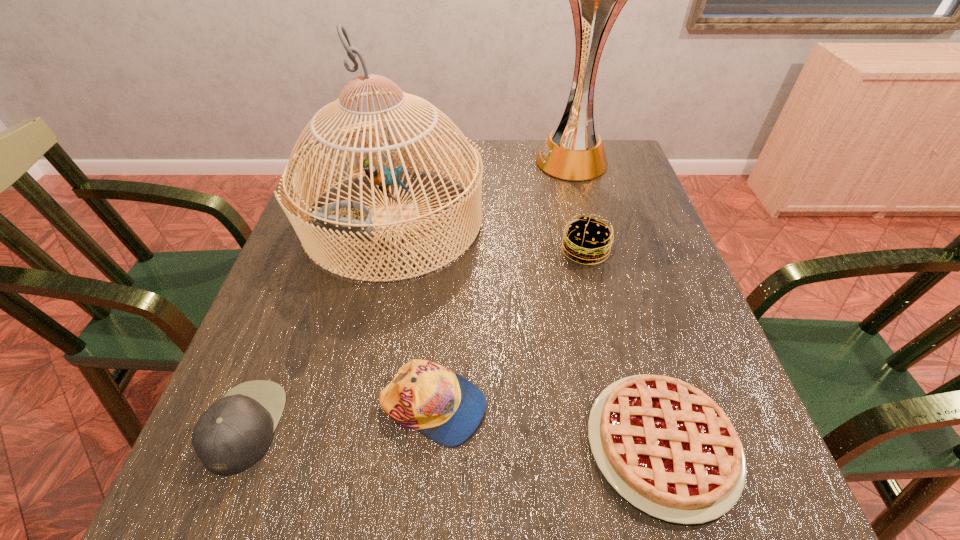
I want to click on free space between the tallest object and the third tallest object, so click(x=579, y=206).

Locate an element on the screen. free area in between the fifth shortest object and the tallest object is located at coordinates (483, 191).

Where is `the fifth closest object to the tallest object`? The image size is (960, 540). the fifth closest object to the tallest object is located at coordinates (230, 436).

You are a GUI agent. You are given a task and a screenshot of the screen. Output one action in this format:
    pyautogui.click(x=<x>, y=<y>)
    Task: Click on the object that is the third closest one to the left cap
    
    Given the screenshot: What is the action you would take?
    pyautogui.click(x=666, y=447)

This screenshot has height=540, width=960. In order to click on vacant space that satisfies the following two spatial constraints: 1. on the brim of the shortest object; 2. on the left side of the left cap in this screenshot , I will do `click(237, 444)`.

The height and width of the screenshot is (540, 960). What are the coordinates of `vacant space that satisfies the following two spatial constraints: 1. on the bill of the right cap; 2. on the right side of the shortest object` in the screenshot? It's located at (430, 444).